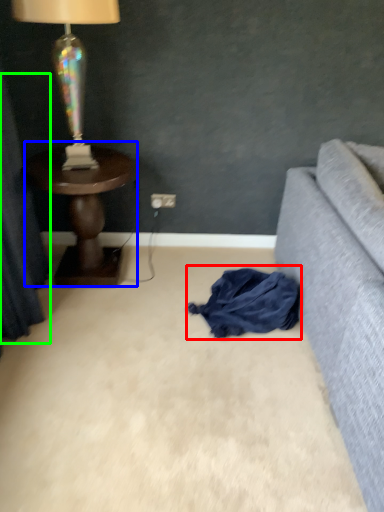
Question: Which is nearer to the clothing (highlighted by a red box)? table (highlighted by a blue box) or curtain (highlighted by a green box).

Choices:
 (A) table
 (B) curtain

Answer: (A)